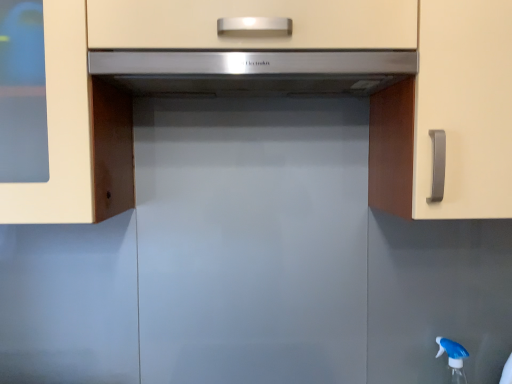
Question: Considering the positions of point (279, 61) and point (458, 377), is point (279, 61) closer or farther from the camera than point (458, 377)?

Choices:
 (A) farther
 (B) closer

Answer: (B)

Question: From a real-world perspective, is satin silver range hood at center physically located above or below blue translucent spray bottle at lower right?

Choices:
 (A) above
 (B) below

Answer: (A)

Question: Which of these objects is positioned closest to the blue translucent spray bottle at lower right?

Choices:
 (A) satin silver range hood at center
 (B) matte white cabinet at center

Answer: (B)

Question: Which object is positioned closest to the satin silver range hood at center?

Choices:
 (A) matte white cabinet at center
 (B) blue translucent spray bottle at lower right

Answer: (A)